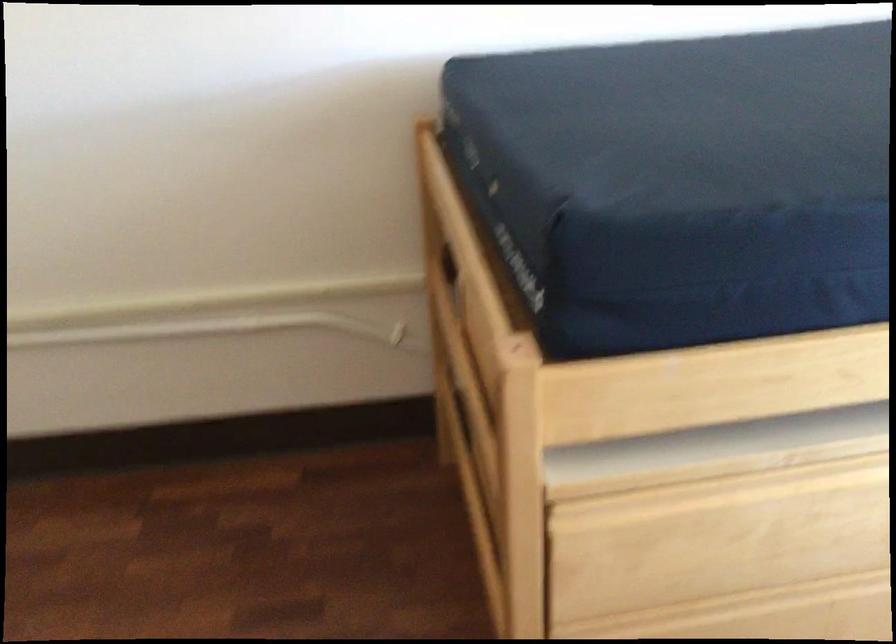
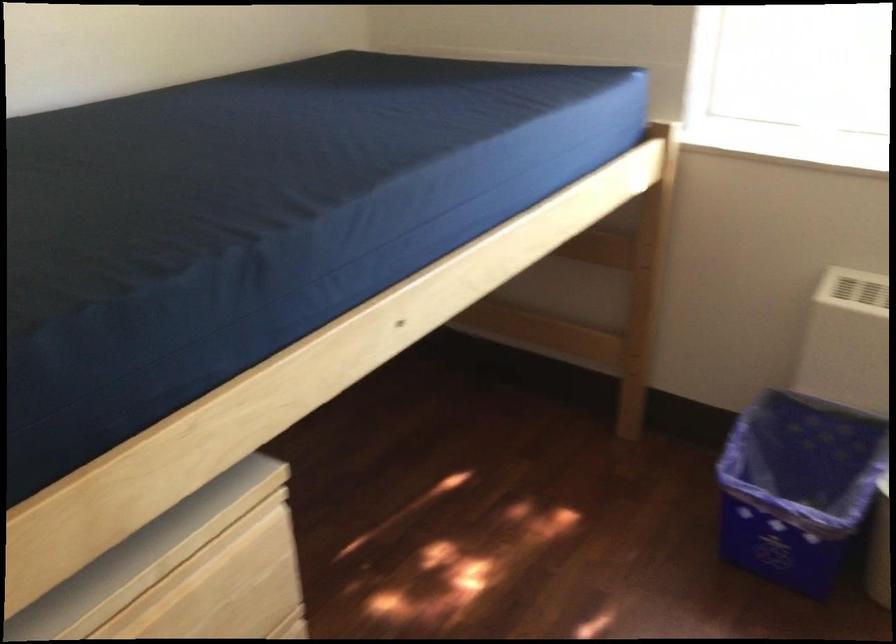
Question: The camera is either moving clockwise (left) or counter-clockwise (right) around the object. The first image is from the beginning of the video and the second image is from the end. Is the camera moving left or right when shooting the video?

Choices:
 (A) Left
 (B) Right

Answer: (A)